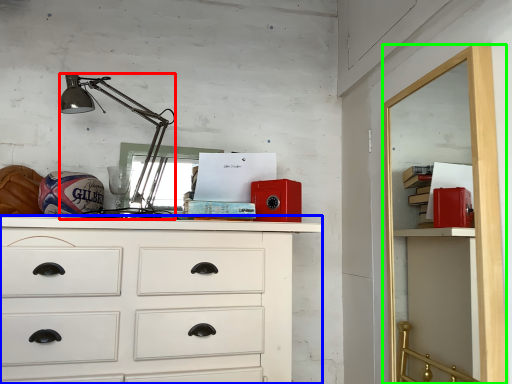
Question: Which object is the closest to the lamp (highlighted by a red box)? Choose among these: chest of drawers (highlighted by a blue box) or file cabinet (highlighted by a green box).

Choices:
 (A) chest of drawers
 (B) file cabinet

Answer: (A)